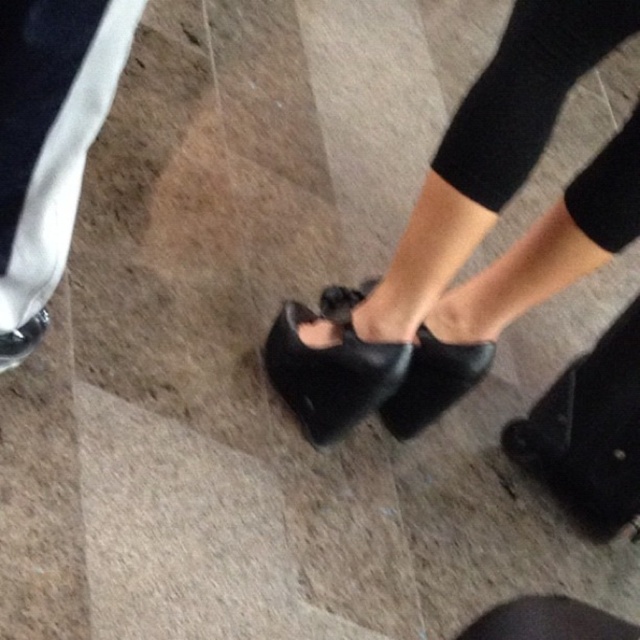
You are trying to decide which shoe to wear for a walk. You have the black leather sandal at center and the matte black shoe at lower center. Based on the image, which one has a wider base for better stability?

The black leather sandal at center might be wider than matte black shoe at lower center, so it could provide better stability for walking.

In the scene shown: You are a photographer setting up a shoot in the scene described. You need to ensure that the black knit tights at center and the black leather shoe at center are both visible in the final image. Given their current positions, is there any adjustment needed to capture both clearly?

The black knit tights at center is positioned over the black leather shoe at center, so you will need to adjust the position of the black knit tights at center or the black leather shoe at center to ensure both are fully visible in the photograph.

You are trying to decide which footwear to wear based on the image. The black leather sandal at center and the black leather shoe at center are both options. Which one has a wider base?

The black leather sandal at center has a wider base than the black leather shoe at center according to the description.